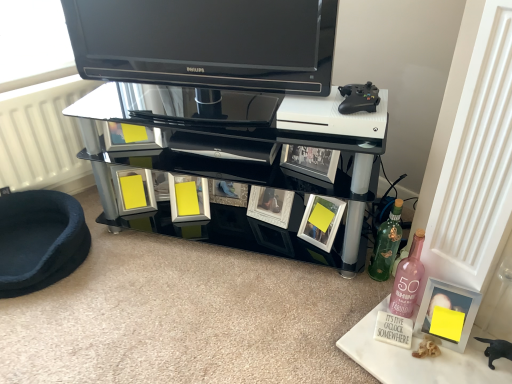
Where is `free space between matte silver picture frame at lower right, the 2th picture frame in the top-to-bottom sequence, and dark blue plush pet bed at lower left`? free space between matte silver picture frame at lower right, the 2th picture frame in the top-to-bottom sequence, and dark blue plush pet bed at lower left is located at coordinates (196, 292).